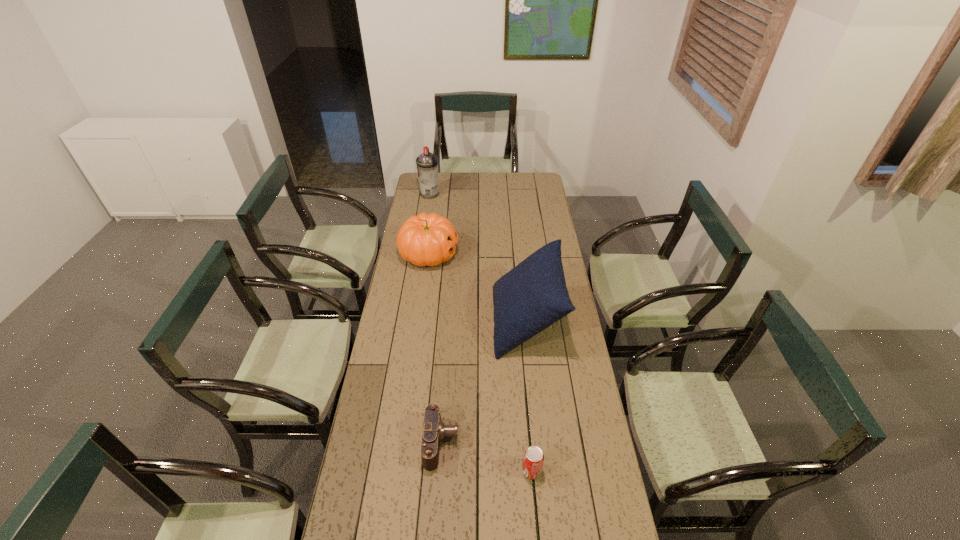
This screenshot has height=540, width=960. What are the coordinates of `free spot located 0.090m on the carved face of the pumpkin` in the screenshot? It's located at (477, 254).

In order to click on free space located on the back of the soda can in this screenshot , I will do `click(522, 358)`.

Where is `blank space located 0.300m on the front-facing side of the camera`? The width and height of the screenshot is (960, 540). blank space located 0.300m on the front-facing side of the camera is located at coordinates (551, 443).

Find the location of a particular element. The height and width of the screenshot is (540, 960). object present at the far edge is located at coordinates (427, 163).

The width and height of the screenshot is (960, 540). I want to click on aerosol can positioned at the left edge, so click(x=427, y=163).

Locate an element on the screen. The height and width of the screenshot is (540, 960). pumpkin present at the left edge is located at coordinates 426,239.

Locate an element on the screen. The width and height of the screenshot is (960, 540). object positioned at the right edge is located at coordinates (532, 296).

The image size is (960, 540). What are the coordinates of `object that is at the far left corner` in the screenshot? It's located at [x=427, y=163].

The height and width of the screenshot is (540, 960). Identify the location of free space at the far edge of the desktop. (507, 191).

This screenshot has height=540, width=960. Identify the location of free spot at the left edge of the desktop. (380, 411).